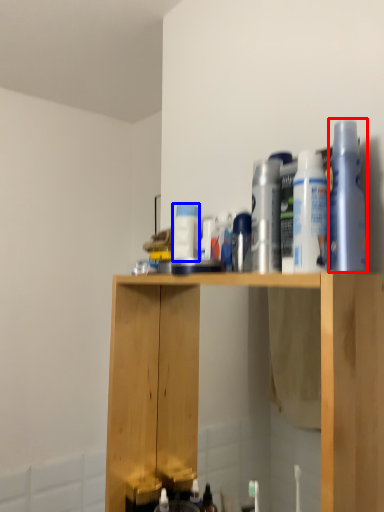
Question: Which object appears closest to the camera in this image, cleaning product (highlighted by a red box) or cleaning product (highlighted by a blue box)?

Choices:
 (A) cleaning product
 (B) cleaning product

Answer: (A)